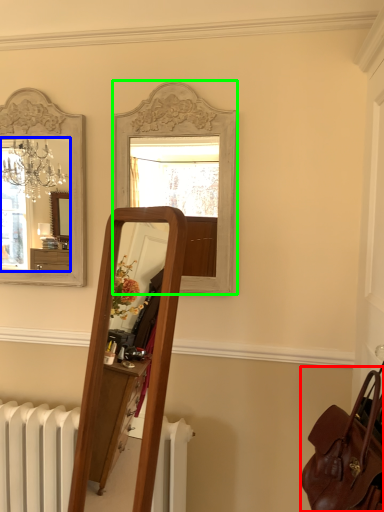
Question: Based on their relative distances, which object is farther from bag (highlighted by a red box)? Choose from mirror (highlighted by a blue box) and mirror (highlighted by a green box).

Choices:
 (A) mirror
 (B) mirror

Answer: (A)